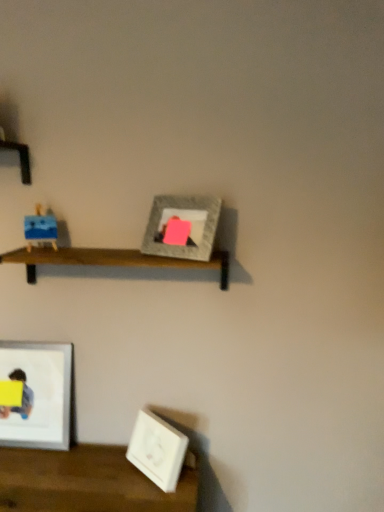
Question: From the image's perspective, is matte gray picture frame at center, which is counted as the third picture frame, starting from the left, positioned above or below wooden shelf at center?

Choices:
 (A) above
 (B) below

Answer: (A)

Question: Would you say matte gray picture frame at center, which is counted as the 1th picture frame, starting from the right, is to the left or to the right of wooden shelf at center in the picture?

Choices:
 (A) left
 (B) right

Answer: (B)

Question: Which object is the closest to the matte gray picture frame at center, which is counted as the third picture frame, starting from the left?

Choices:
 (A) wooden shelf at center
 (B) yellow matte paper at lower left
 (C) white matte picture frame at lower right, which is counted as the second picture frame, starting from the left
 (D) matte blue toy at left
 (E) white glossy picture frame at lower left, which is the second picture frame from top to bottom

Answer: (A)

Question: Which object is positioned closest to the matte blue toy at left?

Choices:
 (A) matte gray picture frame at center, which is counted as the 1th picture frame, starting from the right
 (B) white glossy picture frame at lower left, arranged as the second picture frame when ordered from the bottom
 (C) wooden shelf at center
 (D) white matte picture frame at lower right, positioned as the 1th picture frame in bottom-to-top order
 (E) yellow matte paper at lower left

Answer: (C)